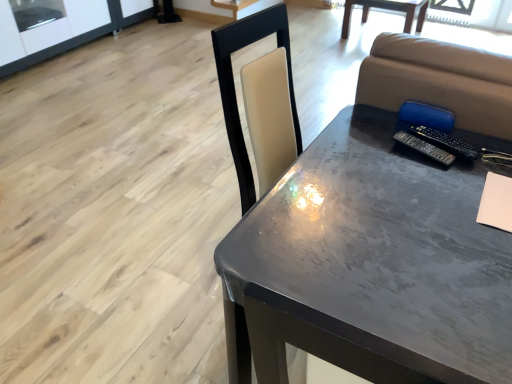
Locate an element on the screen. vacant space that is to the left of beige matte notebook at lower right is located at coordinates (449, 221).